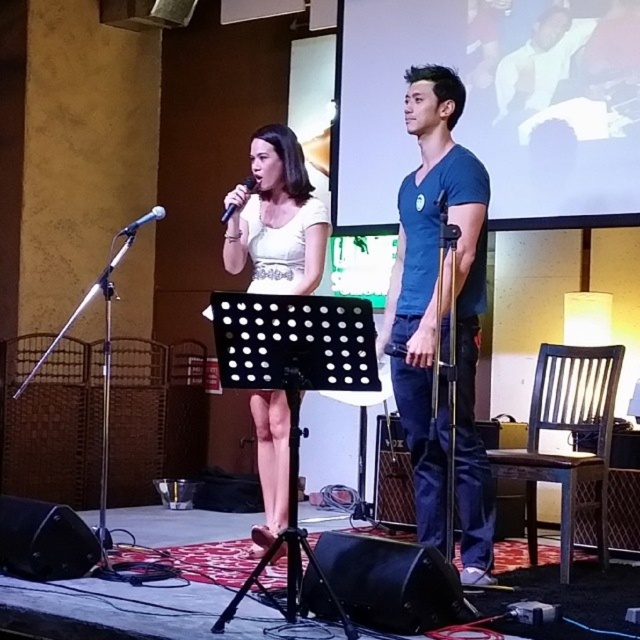
Which is behind, point (451, 90) or point (93, 600)?

The point (451, 90) is more distant.

Is blue cotton t-shirt at center positioned behind black fabric stage at center?

No, blue cotton t-shirt at center is closer to the viewer.

Identify the location of blue cotton t-shirt at center. (436, 321).

From the picture: Does white satin dress at center appear under metallic silver microphone at left?

Yes, white satin dress at center is below metallic silver microphone at left.

Where is `white satin dress at center`? The height and width of the screenshot is (640, 640). white satin dress at center is located at coordinates (276, 218).

Is the position of black fabric stage at center less distant than that of matte black microphone at center?

No, it is behind matte black microphone at center.

Does point (204, 598) lie behind point (227, 209)?

No, it is in front of (227, 209).

Where is `black fabric stage at center`? The image size is (640, 640). black fabric stage at center is located at coordinates (125, 611).